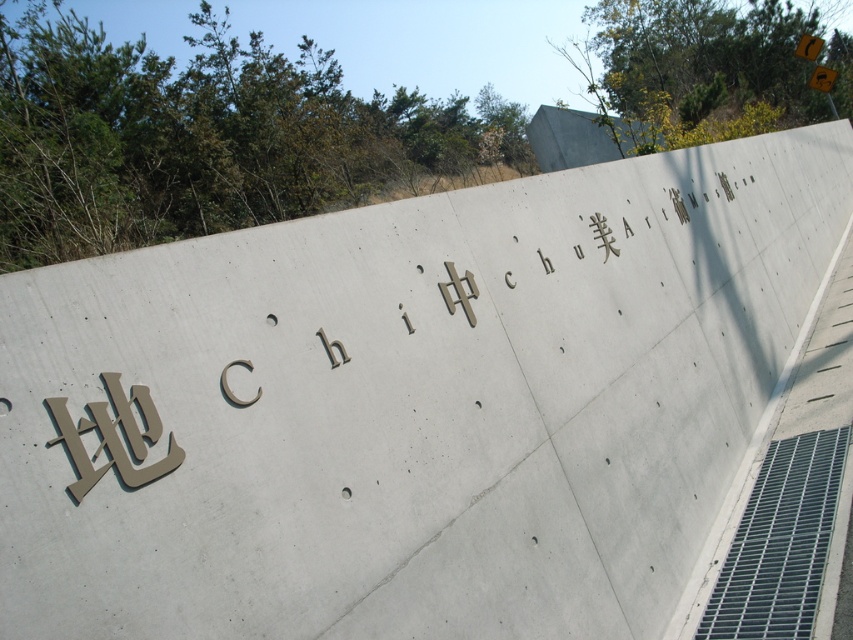
Can you confirm if yellow reflective plastic at upper right is wider than yellow plastic sign at upper right?

In fact, yellow reflective plastic at upper right might be narrower than yellow plastic sign at upper right.

Is yellow reflective plastic at upper right to the left of yellow plastic sign at upper right from the viewer's perspective?

Yes, yellow reflective plastic at upper right is to the left of yellow plastic sign at upper right.

Is point (828, 81) less distant than point (811, 44)?

Yes.

Find the location of `yellow reflective plastic at upper right`. yellow reflective plastic at upper right is located at coordinates (822, 77).